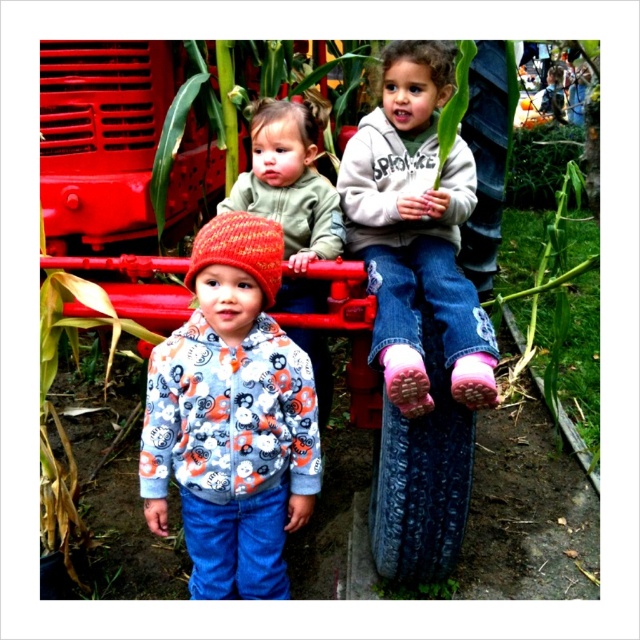
You are a photographer standing at the edge of the scene. You want to take a closeup photo of the knitted woolen hat at center and the pink fuzzy socks at center. The camera can focus on objects within a 12 inch range. Will both items be in focus?

The knitted woolen hat at center is 14.03 inches from pink fuzzy socks at center, which is beyond the camera focus range of 12 inches. Therefore, both items cannot be in focus simultaneously.